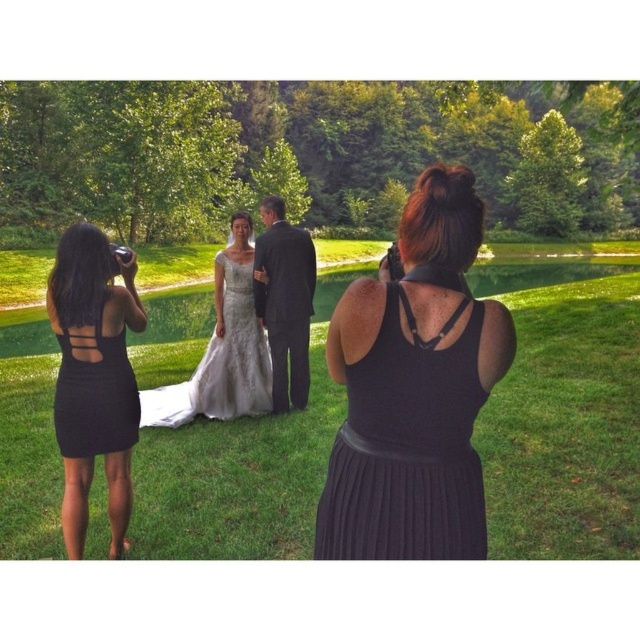
Question: Can you confirm if satin white gown at center is wider than black ribbed dress at left?

Choices:
 (A) yes
 (B) no

Answer: (B)

Question: Does satin white gown at center have a larger size compared to ivory lace dress at center?

Choices:
 (A) no
 (B) yes

Answer: (B)

Question: Which of the following is the closest to the observer?

Choices:
 (A) (109, 451)
 (B) (230, 230)
 (C) (128, 288)
 (D) (474, 504)

Answer: (D)

Question: Which point is farther from the camera taking this photo?

Choices:
 (A) (419, 444)
 (B) (289, 353)

Answer: (B)

Question: Is black ribbed dress at center positioned at the back of black ribbed dress at left?

Choices:
 (A) no
 (B) yes

Answer: (A)

Question: Which point appears closest to the camera in this image?

Choices:
 (A) (236, 284)
 (B) (88, 490)
 (C) (426, 285)

Answer: (C)